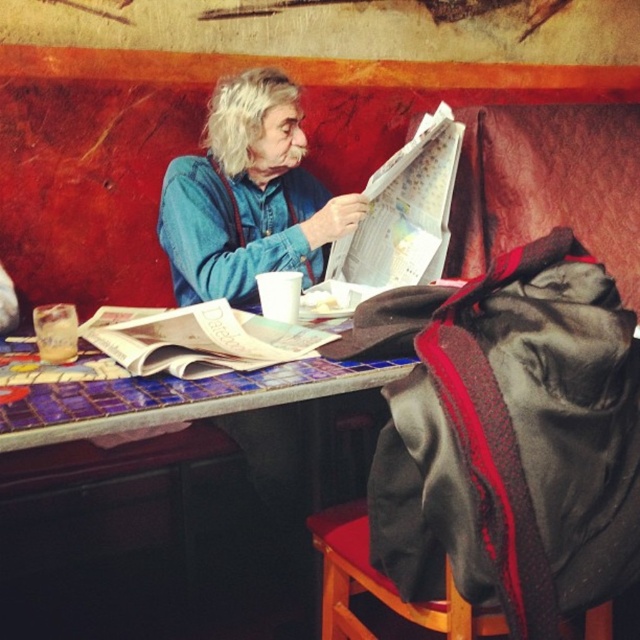
Question: Estimate the real-world distances between objects in this image. Which object is farther from the blue denim shirt at center?

Choices:
 (A) black fleece blanket at lower right
 (B) white glossy newspaper at center

Answer: (A)

Question: Can you confirm if black fleece blanket at lower right is positioned to the right of blue denim shirt at center?

Choices:
 (A) yes
 (B) no

Answer: (A)

Question: Among these objects, which one is nearest to the camera?

Choices:
 (A) white glossy newspaper at center
 (B) wooden stool at lower right
 (C) blue denim shirt at center
 (D) black fleece blanket at lower right

Answer: (D)

Question: Is black fleece blanket at lower right in front of blue mosaic tile table at center?

Choices:
 (A) yes
 (B) no

Answer: (A)

Question: Based on their relative distances, which object is farther from the blue denim shirt at center?

Choices:
 (A) white glossy newspaper at center
 (B) blue mosaic tile table at center

Answer: (B)

Question: Where is black fleece blanket at lower right located in relation to wooden stool at lower right in the image?

Choices:
 (A) above
 (B) below

Answer: (A)